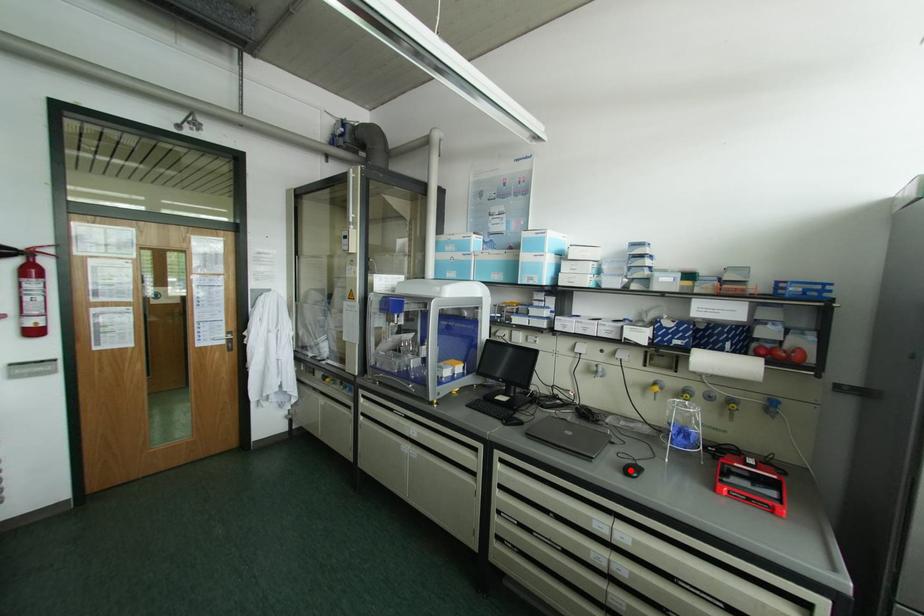
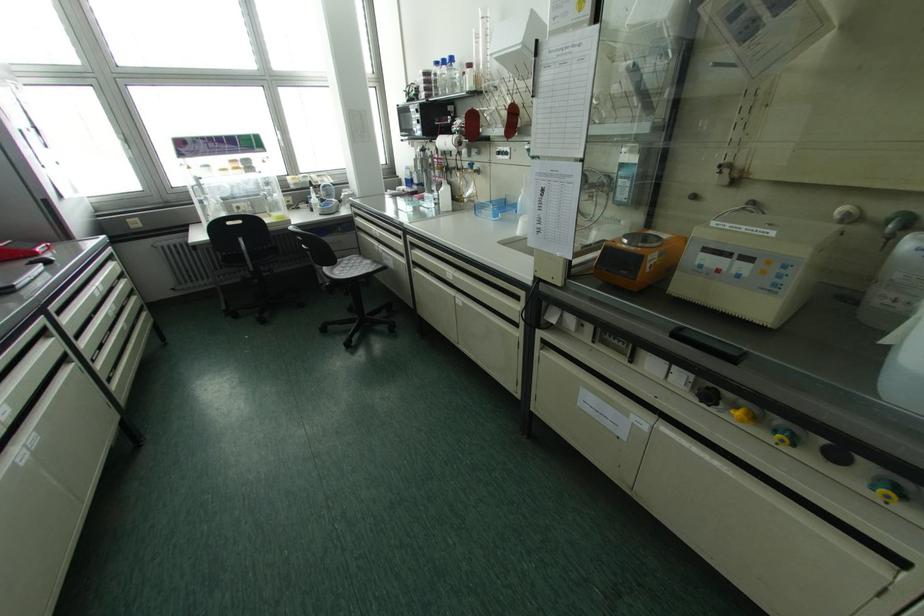
Question: I am providing you with two images of the same scene from different viewpoints. Given a red point in image1, look at the same physical point in image2. Is it:

Choices:
 (A) Closer to the viewpoint
 (B) Farther from the viewpoint

Answer: (B)